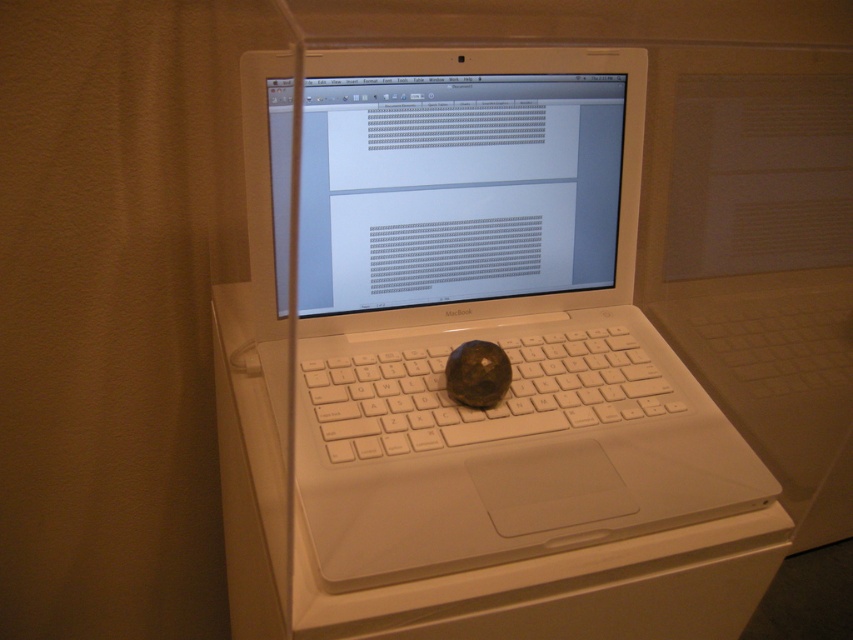
Between point (763, 467) and point (616, 349), which one is positioned behind?

Positioned behind is point (616, 349).

Between point (509, 204) and point (590, 378), which one is positioned behind?

Positioned behind is point (509, 204).

You are a GUI agent. You are given a task and a screenshot of the screen. Output one action in this format:
    pyautogui.click(x=<x>, y=<y>)
    Task: Click on the white plastic laptop at center
    This screenshot has width=853, height=640.
    Given the screenshot: What is the action you would take?
    pyautogui.click(x=486, y=317)